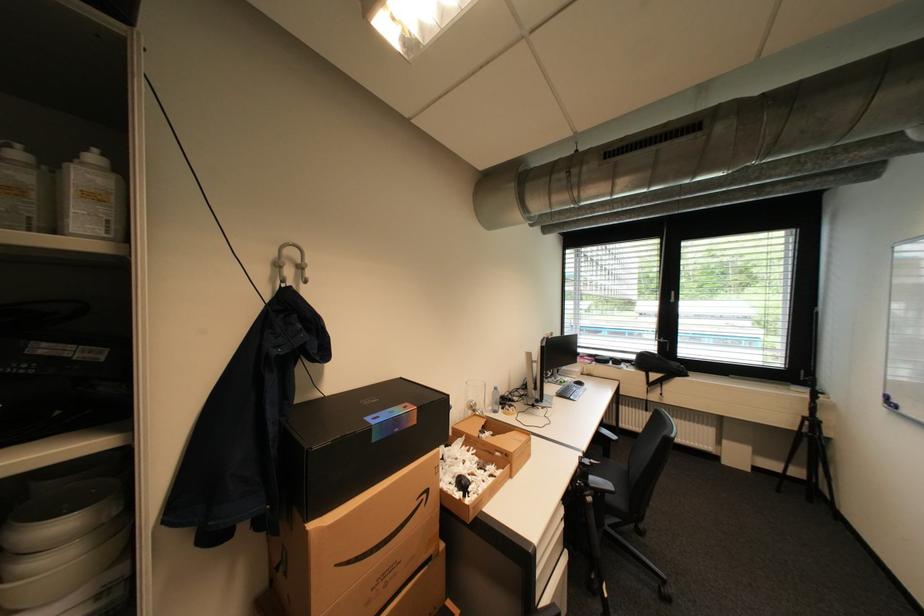
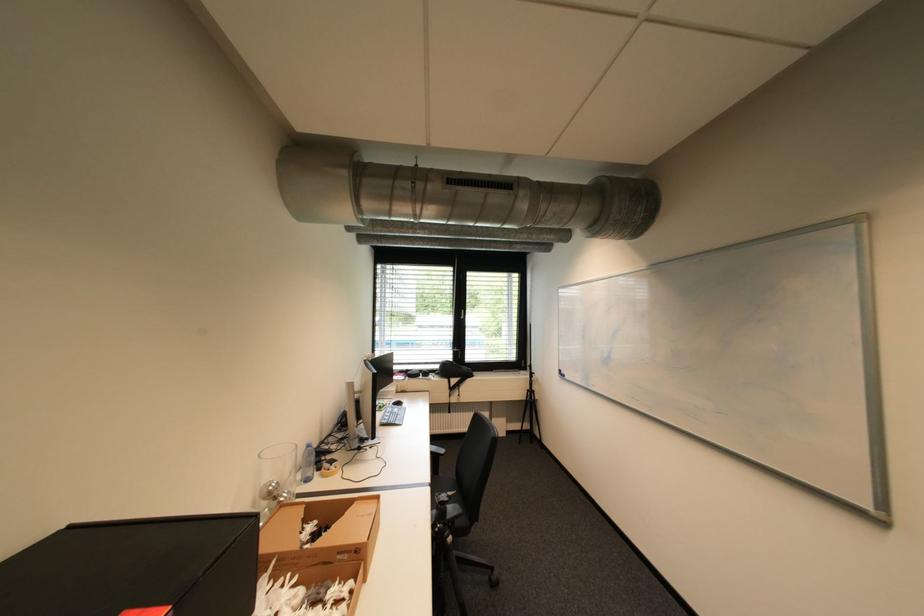
In the second image, find the point that corresponds to (575,379) in the first image.

(393, 403)